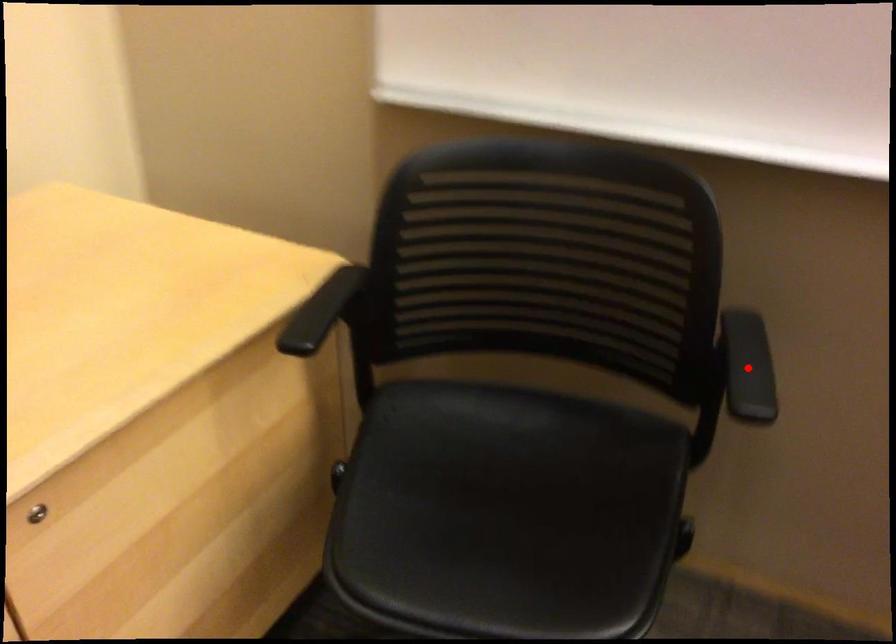
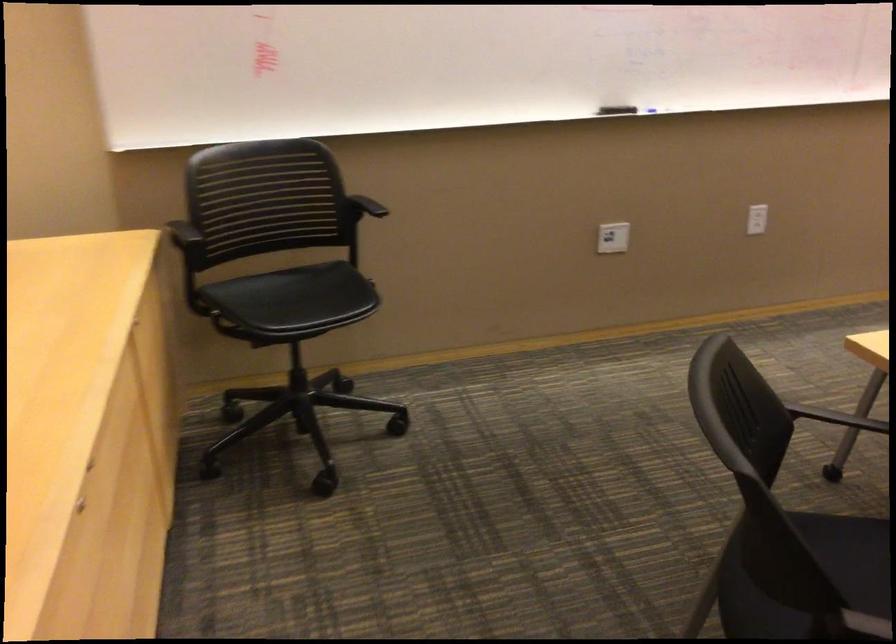
In the second image, find the point that corresponds to the highlighted location in the first image.

(375, 220)